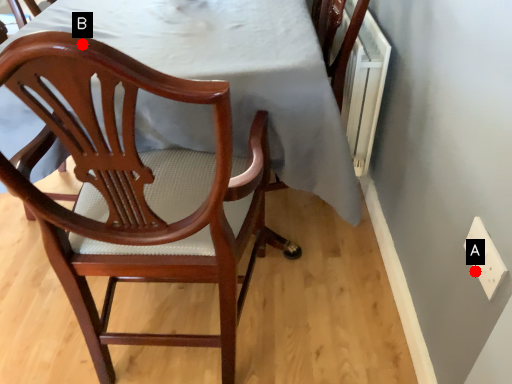
Question: Two points are circled on the image, labeled by A and B beside each circle. Which of the following is the farthest from the observer?

Choices:
 (A) A is further
 (B) B is further

Answer: (A)